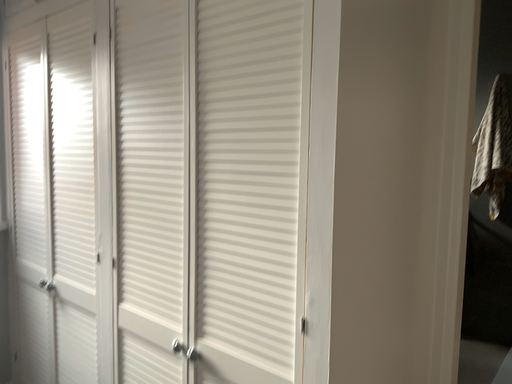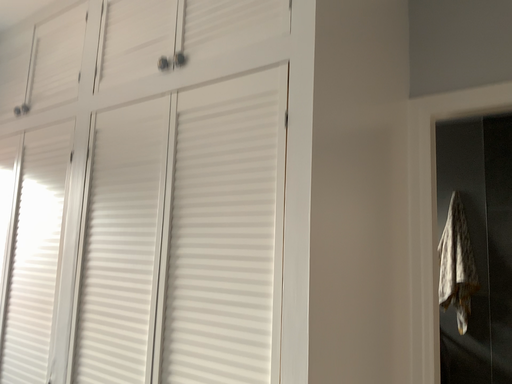
Question: Which way did the camera rotate in the video?

Choices:
 (A) rotated downward
 (B) rotated upward

Answer: (B)